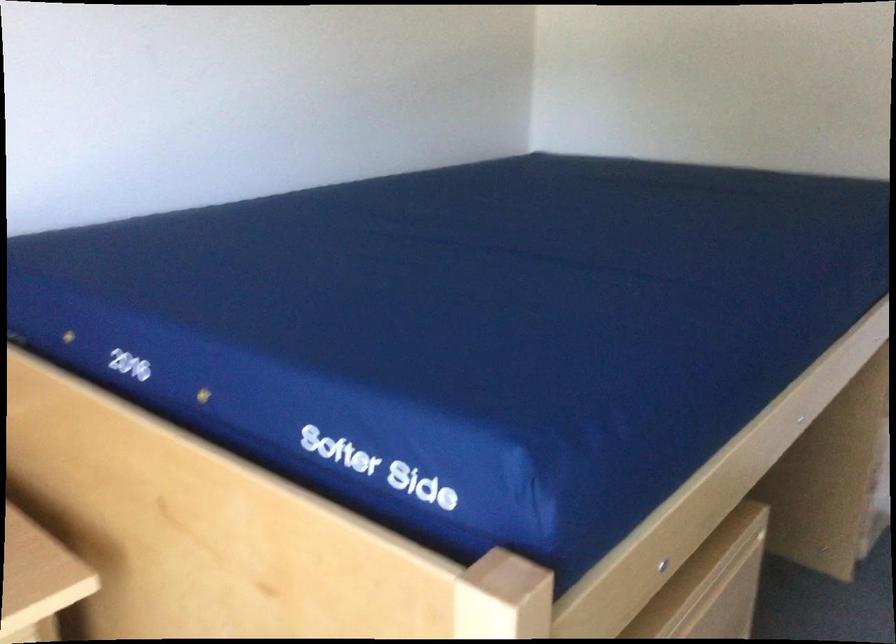
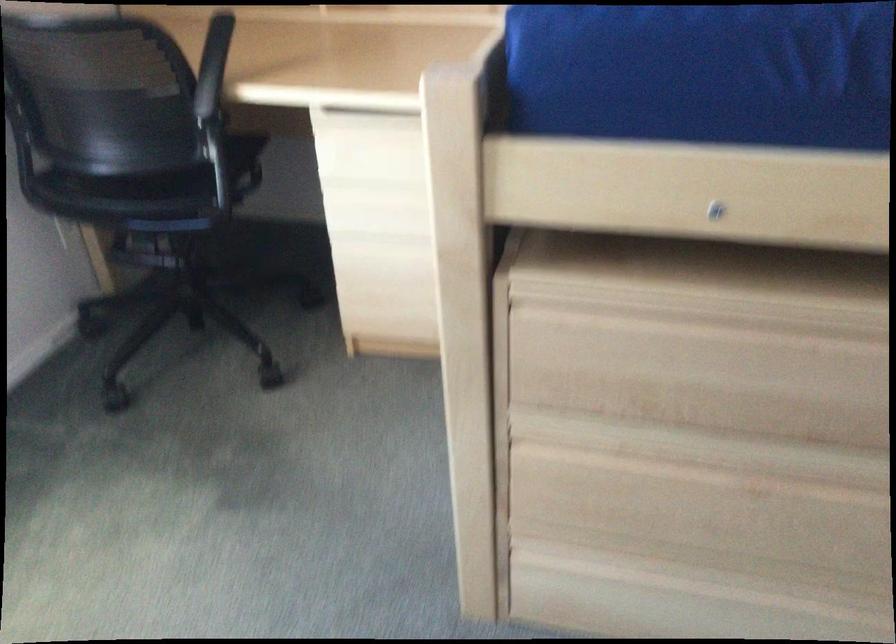
How did the camera likely rotate?

The rotation direction of the camera is left-down.